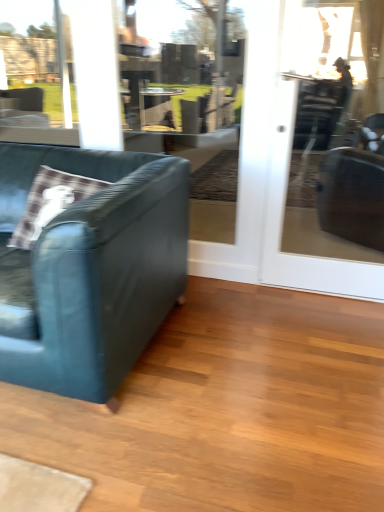
Question: Is transparent glass screen door at center taller or shorter than velvet teal couch at left?

Choices:
 (A) short
 (B) tall

Answer: (B)

Question: Considering the positions of transparent glass screen door at center and velvet teal couch at left in the image, is transparent glass screen door at center wider or thinner than velvet teal couch at left?

Choices:
 (A) thin
 (B) wide

Answer: (A)

Question: Visually, is transparent glass screen door at center positioned to the left or to the right of velvet teal couch at left?

Choices:
 (A) left
 (B) right

Answer: (B)

Question: From a real-world perspective, is velvet teal couch at left above or below transparent glass screen door at center?

Choices:
 (A) above
 (B) below

Answer: (B)

Question: Looking at the image, does velvet teal couch at left seem bigger or smaller compared to transparent glass screen door at center?

Choices:
 (A) big
 (B) small

Answer: (A)

Question: Is velvet teal couch at left situated inside transparent glass screen door at center or outside?

Choices:
 (A) outside
 (B) inside

Answer: (A)

Question: Considering the positions of velvet teal couch at left and transparent glass screen door at center in the image, is velvet teal couch at left taller or shorter than transparent glass screen door at center?

Choices:
 (A) tall
 (B) short

Answer: (B)